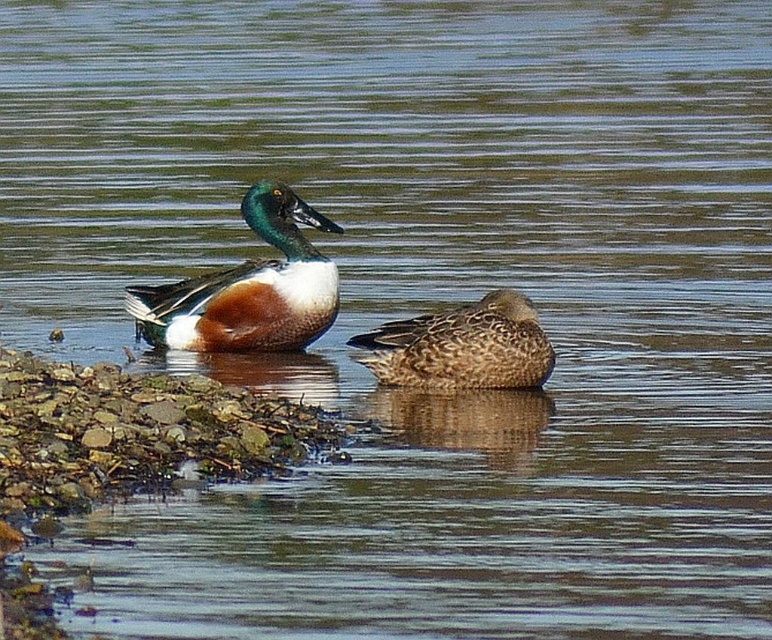
You are standing on the rocky shoreline in the image and want to observe both the shiny green duck at center and the brown speckled duck at center. Which duck is positioned closer to your left side?

The shiny green duck at center is positioned to the left of the brown speckled duck at center, so from your perspective on the rocky shoreline, the shiny green duck at center would be closer to your left side.

You are a birdwatcher observing two ducks in a pond. You notice the shiny green duck at center and the brown speckled duck at center. Which duck is closer to the observer?

The shiny green duck at center is closer to the observer because the brown speckled duck at center is behind it.

You are a wildlife photographer trying to capture a closeup shot of both the shiny green duck at center and the brown speckled duck at center. Your camera has a zoom lens that can focus on objects up to 1 meter away. Can you get both ducks in focus without moving your camera?

The shiny green duck at center and the brown speckled duck at center are 1.06 meters apart. Since the distance between them exceeds the camera lens focus range of 1 meter, you cannot get both ducks in focus simultaneously without moving the camera.